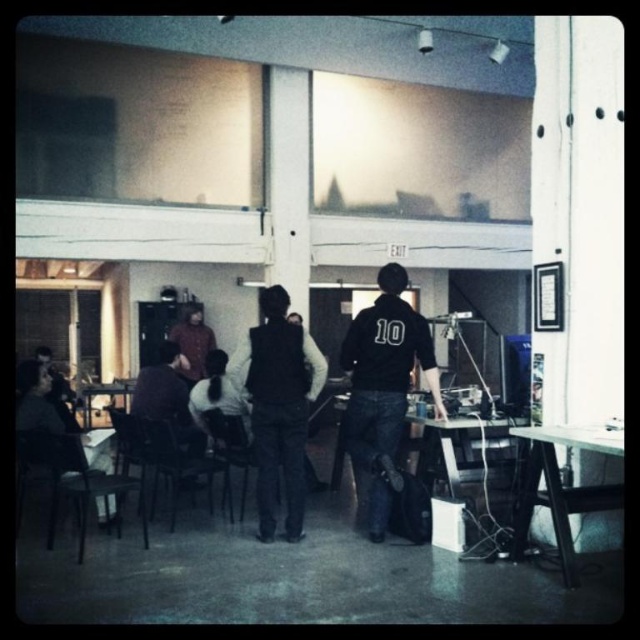
Looking at this image, you are an observer in the room. You notice two items at the center of the scene. Which one is closer to you, the black matte vest at center or the dark brown leather jacket at center?

The black matte vest at center is closer to you since it is in front of the dark brown leather jacket at center.

You are organizing a small event and need to know if the black matte vest at center can be placed on the white glossy table at lower right without hanging over the edges. Can you confirm if the vest fits on the table?

The black matte vest at center is larger in size than the white glossy table at lower right, so it would not fit entirely on the table and would hang over the edges.

You are standing in the middle of the room and see both the black matte jacket at center and the matte brown jacket at center. Which jacket is nearer to you?

The black matte jacket at center is closer to the viewer than the matte brown jacket at center, so the black matte jacket at center is nearer to you.